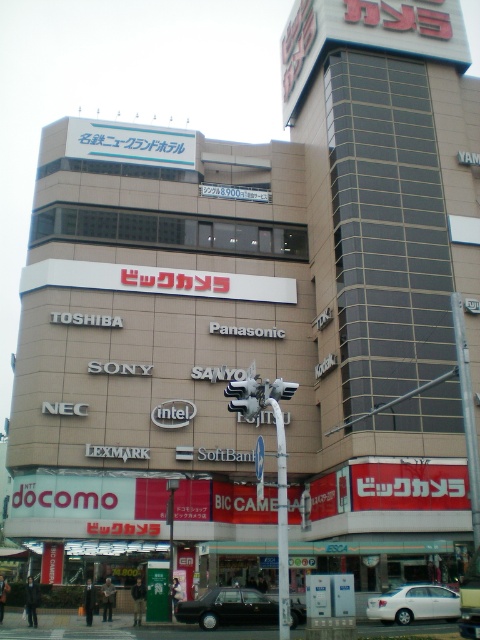
A black glossy car at center is parked in front of a building. The car is at point 0.952 on the x axis and 0.477 on the y axis. If the building entrance is at the bottom of the image, which direction should the driver turn to head towards the entrance?

The black glossy car at center is located at coordinates 0.952 on the x axis and 0.477 on the y axis. Since the entrance is at the bottom of the image, the driver should turn downward to reach it.

From the picture: You are standing in front of a commercial building in Japan with various electronic brands displayed on its facade. You notice a point labeled at coordinates (228,609). What object is located at this point?

The point at coordinates (228,609) is occupied by a black glossy car at center.